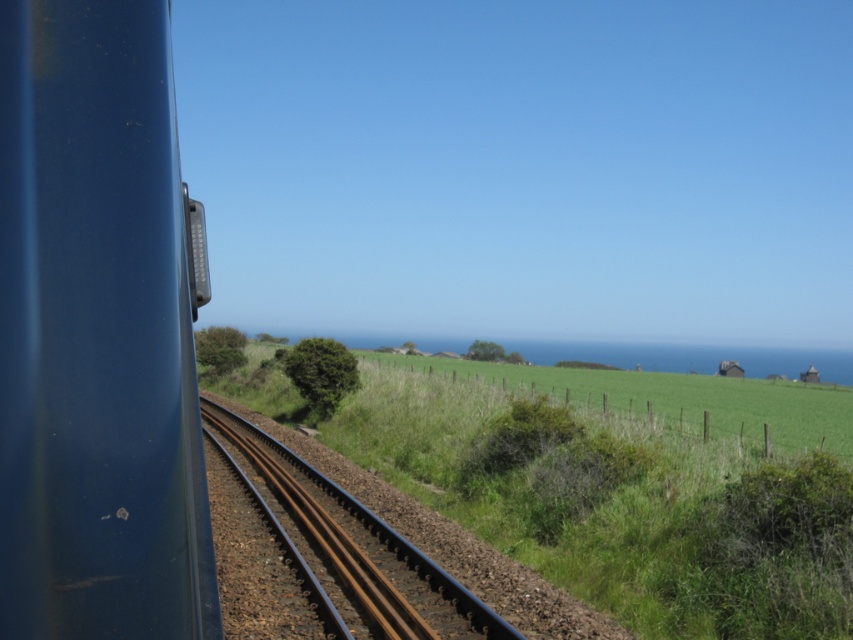
You are a passenger on the train and looking out the window. You see the green grassy at center and the brown metal track at center. Which one takes up more space in the view?

The green grassy at center takes up more space in the view because it is bigger than the brown metal track at center.

From the picture: You are inside a train and looking through the window. You notice a point at coordinates (96, 333). What object is located at that point?

The point at (96, 333) has a matte blue train at left.